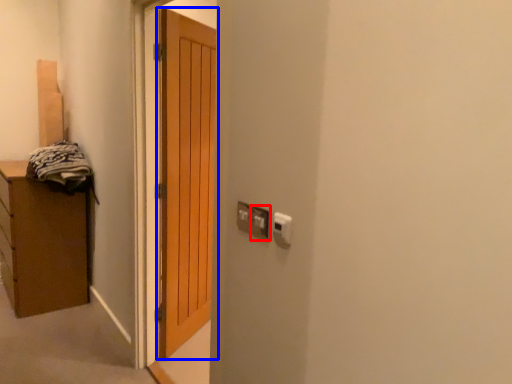
Question: Among these objects, which one is farthest to the camera, electric outlet (highlighted by a red box) or door (highlighted by a blue box)?

Choices:
 (A) electric outlet
 (B) door

Answer: (B)